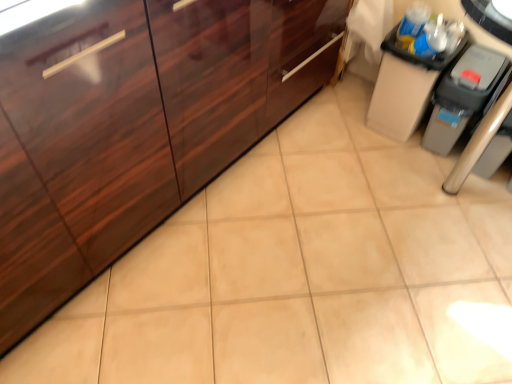
Question: Is matte black trash can at upper right, positioned as the 1th cabinetry in right-to-left order, wider or thinner than glossy wood cabinetry at left, marked as the 1th cabinetry in a left-to-right arrangement?

Choices:
 (A) wide
 (B) thin

Answer: (B)

Question: From the image's perspective, is matte black trash can at upper right, acting as the 2th cabinetry starting from the left, located above or below glossy wood cabinetry at left, the second cabinetry in the right-to-left sequence?

Choices:
 (A) below
 (B) above

Answer: (B)

Question: Which is farther from the glossy wood cabinetry at left, marked as the 1th cabinetry in a left-to-right arrangement?

Choices:
 (A) matte black trash can at upper right, acting as the 2th cabinetry starting from the left
 (B) gray plastic trash can at right

Answer: (B)

Question: Which is farther from the glossy wood cabinetry at left, the second cabinetry in the right-to-left sequence?

Choices:
 (A) matte black trash can at upper right, acting as the 2th cabinetry starting from the left
 (B) gray plastic trash can at right

Answer: (B)